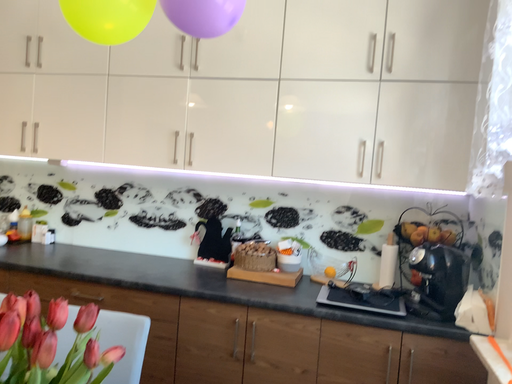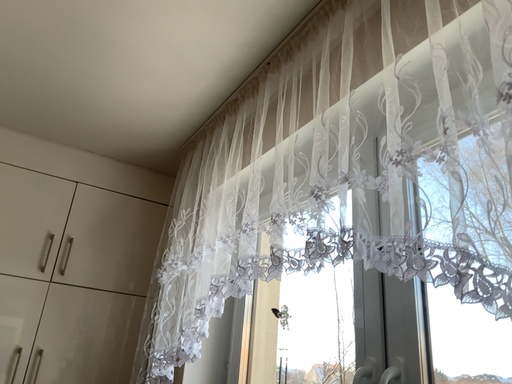
Question: Which way did the camera rotate in the video?

Choices:
 (A) rotated left
 (B) rotated right

Answer: (B)